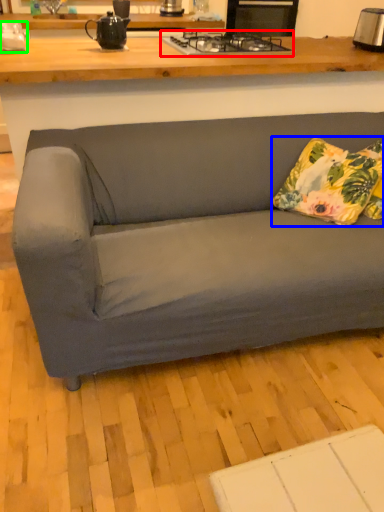
Question: Which object is the closest to the gas stove (highlighted by a red box)? Choose among these: pillow (highlighted by a blue box) or appliance (highlighted by a green box).

Choices:
 (A) pillow
 (B) appliance

Answer: (A)